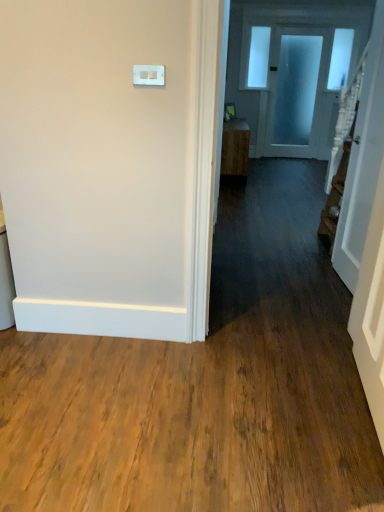
Describe the element at coordinates (363, 161) in the screenshot. Image resolution: width=384 pixels, height=512 pixels. I see `white glossy door at right, acting as the first door starting from the front` at that location.

What is the approximate height of white plastic light switch at upper center?

3.92 inches.

I want to click on wooden cabinet at center, so click(x=235, y=148).

Is frosted glass door at upper center, which is the second door in left-to-right order, oriented towards white glossy door at right, which appears as the second door when viewed from the back?

Yes, frosted glass door at upper center, which is the second door in left-to-right order, is facing white glossy door at right, which appears as the second door when viewed from the back.

Looking at this image, does frosted glass door at upper center, the first door viewed from the right, have a larger size compared to white glossy door at right, positioned as the 2th door in top-to-bottom order?

Yes.

From a real-world perspective, is frosted glass door at upper center, the 2th door when ordered from bottom to top, over white glossy door at right, positioned as the 2th door in top-to-bottom order?

Correct, in the physical world, frosted glass door at upper center, the 2th door when ordered from bottom to top, is higher than white glossy door at right, positioned as the 2th door in top-to-bottom order.

Can you tell me how much frosted glass door at upper center, the 1th door from the top, and white glossy door at right, arranged as the 1th door when viewed from the left, differ in facing direction?

They differ by 92.2 degrees in their facing directions.

From the image's perspective, is white glossy door at right, which is the second door from right to left, above or below wooden cabinet at center?

white glossy door at right, which is the second door from right to left, is below wooden cabinet at center.

Is white glossy door at right, the first door when ordered from bottom to top, with wooden cabinet at center?

No, white glossy door at right, the first door when ordered from bottom to top, is not touching wooden cabinet at center.

Between white glossy door at right, which is the second door from right to left, and wooden cabinet at center, which one has smaller size?

white glossy door at right, which is the second door from right to left, is smaller.

From a real-world perspective, is white glossy door at right, which appears as the second door when viewed from the back, above or below wooden cabinet at center?

white glossy door at right, which appears as the second door when viewed from the back, is above wooden cabinet at center.

Is wooden cabinet at center beside white plastic light switch at upper center?

No, wooden cabinet at center is not making contact with white plastic light switch at upper center.

From the image's perspective, which is below, wooden cabinet at center or white plastic light switch at upper center?

white plastic light switch at upper center.

From the picture: From a real-world perspective, who is located higher, wooden cabinet at center or white plastic light switch at upper center?

From a 3D spatial view, white plastic light switch at upper center is above.

From the image's perspective, relative to wooden cabinet at center, is white plastic light switch at upper center above or below?

Clearly, from the image's perspective, white plastic light switch at upper center is below wooden cabinet at center.

Is white plastic light switch at upper center facing towards wooden cabinet at center?

No, white plastic light switch at upper center is not turned towards wooden cabinet at center.

Considering the points (137, 70) and (245, 148), which point is in front, point (137, 70) or point (245, 148)?

Point (137, 70)

Is white plastic light switch at upper center to the right of wooden cabinet at center from the viewer's perspective?

In fact, white plastic light switch at upper center is to the left of wooden cabinet at center.

Based on the photo, from a real-world perspective, who is located higher, frosted glass door at upper center, which is the second door in left-to-right order, or wooden cabinet at center?

frosted glass door at upper center, which is the second door in left-to-right order, from a real-world perspective.

Measure the distance between frosted glass door at upper center, the 2th door when ordered from bottom to top, and wooden cabinet at center.

frosted glass door at upper center, the 2th door when ordered from bottom to top, is 4.93 feet from wooden cabinet at center.

Does frosted glass door at upper center, which is the second door in left-to-right order, turn towards wooden cabinet at center?

No, frosted glass door at upper center, which is the second door in left-to-right order, is not facing towards wooden cabinet at center.

From the image's perspective, is frosted glass door at upper center, placed as the 1th door when sorted from back to front, over white plastic light switch at upper center?

Yes, from the image's perspective, frosted glass door at upper center, placed as the 1th door when sorted from back to front, is over white plastic light switch at upper center.

Between frosted glass door at upper center, the first door viewed from the right, and white plastic light switch at upper center, which one has more height?

Standing taller between the two is frosted glass door at upper center, the first door viewed from the right.

Is frosted glass door at upper center, the first door viewed from the right, looking in the opposite direction of white plastic light switch at upper center?

No, frosted glass door at upper center, the first door viewed from the right,'s orientation is not away from white plastic light switch at upper center.

This screenshot has width=384, height=512. In order to click on light switch lying above the white glossy door at right, arranged as the 1th door when viewed from the left (from the image's perspective) in this screenshot , I will do `click(149, 75)`.

Is there a large distance between white plastic light switch at upper center and white glossy door at right, arranged as the 1th door when viewed from the left?

white plastic light switch at upper center is positioned a significant distance from white glossy door at right, arranged as the 1th door when viewed from the left.

From a real-world perspective, who is located higher, white plastic light switch at upper center or white glossy door at right, the first door when ordered from bottom to top?

white plastic light switch at upper center is physically above.

From the image's perspective, between white plastic light switch at upper center and white glossy door at right, acting as the first door starting from the front, who is located below?

From the image's view, white glossy door at right, acting as the first door starting from the front, is below.

At what (x,y) coordinates should I click in order to perform the action: click on door that appears above the white glossy door at right, which is the second door from right to left (from the image's perspective). Please return your answer as a coordinate pair (x, y). This screenshot has height=512, width=384. Looking at the image, I should click on [x=299, y=93].

Locate an element on the screen. This screenshot has width=384, height=512. door that is the 1st object to the right of the wooden cabinet at center, starting at the anchor is located at coordinates (363, 161).

Looking at the image, which one is located further to wooden cabinet at center, frosted glass door at upper center, which is the second door in left-to-right order, or white glossy door at right, positioned as the 2th door in top-to-bottom order?

Based on the image, white glossy door at right, positioned as the 2th door in top-to-bottom order, appears to be further to wooden cabinet at center.

Looking at the image, which one is located closer to white plastic light switch at upper center, frosted glass door at upper center, the 1th door from the top, or wooden cabinet at center?

wooden cabinet at center is closer to white plastic light switch at upper center.

Which object lies further to the anchor point white glossy door at right, acting as the first door starting from the front, wooden cabinet at center or frosted glass door at upper center, which is the second door in left-to-right order?

frosted glass door at upper center, which is the second door in left-to-right order, lies further to white glossy door at right, acting as the first door starting from the front, than the other object.

Looking at the image, which one is located closer to white glossy door at right, arranged as the 1th door when viewed from the left, white plastic light switch at upper center or frosted glass door at upper center, placed as the 1th door when sorted from back to front?

white plastic light switch at upper center lies closer to white glossy door at right, arranged as the 1th door when viewed from the left, than the other object.

Looking at the image, which one is located further to frosted glass door at upper center, which is the second door in left-to-right order, wooden cabinet at center or white glossy door at right, which is the second door from right to left?

The object further to frosted glass door at upper center, which is the second door in left-to-right order, is white glossy door at right, which is the second door from right to left.

Based on their spatial positions, is white glossy door at right, which is the second door from right to left, or white plastic light switch at upper center further from wooden cabinet at center?

white plastic light switch at upper center.

From the image, which object appears to be farther from white glossy door at right, arranged as the 1th door when viewed from the left, frosted glass door at upper center, the 2th door when ordered from bottom to top, or wooden cabinet at center?

frosted glass door at upper center, the 2th door when ordered from bottom to top, is positioned further to the anchor white glossy door at right, arranged as the 1th door when viewed from the left.

When comparing their distances from white plastic light switch at upper center, does wooden cabinet at center or white glossy door at right, acting as the first door starting from the front, seem further?

The object further to white plastic light switch at upper center is wooden cabinet at center.

The width and height of the screenshot is (384, 512). What are the coordinates of `furniture located between white glossy door at right, which is the second door from right to left, and frosted glass door at upper center, which is the second door in left-to-right order, in the depth direction` in the screenshot? It's located at (235, 148).

What are the coordinates of `door positioned between white plastic light switch at upper center and wooden cabinet at center from near to far` in the screenshot? It's located at (363, 161).

Locate an element on the screen. The image size is (384, 512). door positioned between white plastic light switch at upper center and frosted glass door at upper center, which appears as the 2th door when viewed from the front, from near to far is located at coordinates (363, 161).

Where is `furniture between white plastic light switch at upper center and frosted glass door at upper center, the 1th door from the top, from front to back`? This screenshot has height=512, width=384. furniture between white plastic light switch at upper center and frosted glass door at upper center, the 1th door from the top, from front to back is located at coordinates (235, 148).